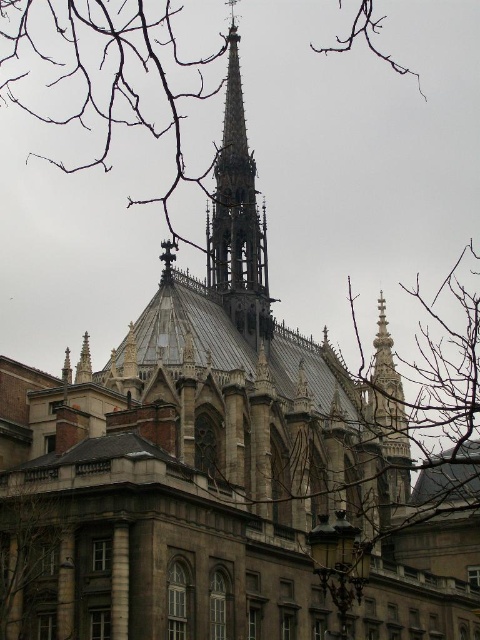
Is stone spire at center above brown wood tree at lower left?

Indeed, stone spire at center is positioned over brown wood tree at lower left.

Can you confirm if stone spire at center is shorter than brown wood tree at lower left?

Incorrect, stone spire at center's height does not fall short of brown wood tree at lower left's.

Does point (239, 144) lie in front of point (26, 579)?

No.

Where is `stone spire at center`? This screenshot has height=640, width=480. stone spire at center is located at coordinates (238, 220).

Is stone spire at center thinner than smooth stone spire at center?

Correct, stone spire at center's width is less than smooth stone spire at center's.

Between stone spire at center and smooth stone spire at center, which one is positioned higher?

stone spire at center

Is point (252, 275) farther from camera compared to point (382, 493)?

Yes, point (252, 275) is farther from viewer.

At what (x,y) coordinates should I click in order to perform the action: click on stone spire at center. Please return your answer as a coordinate pair (x, y). Looking at the image, I should click on pyautogui.click(x=238, y=220).

Which is in front, point (396, 436) or point (372, 433)?

Point (372, 433)

Can you confirm if brown wood tree at center is positioned below smooth stone spire at center?

Yes.

Between point (424, 348) and point (403, 454), which one is positioned behind?

Positioned behind is point (424, 348).

Image resolution: width=480 pixels, height=640 pixels. What are the coordinates of `brown wood tree at center` in the screenshot? It's located at (428, 397).